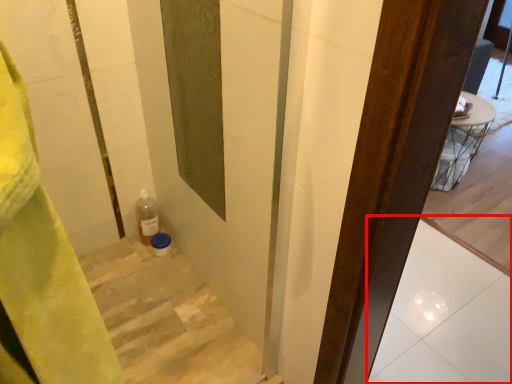
Question: In this image, where is tile (annotated by the red box) located relative to stairs?

Choices:
 (A) right
 (B) left

Answer: (A)